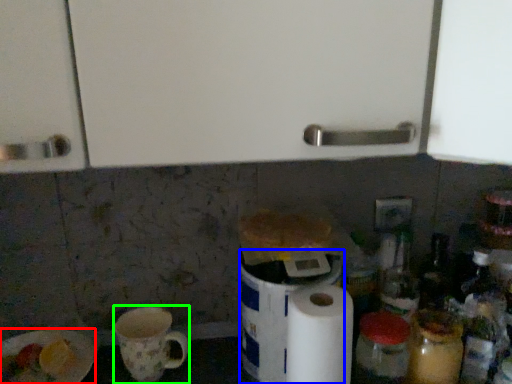
Question: Which object is positioned closest to paper plate (highlighted by a red box)? Select from appliance (highlighted by a blue box) and mug (highlighted by a green box).

Choices:
 (A) appliance
 (B) mug

Answer: (B)